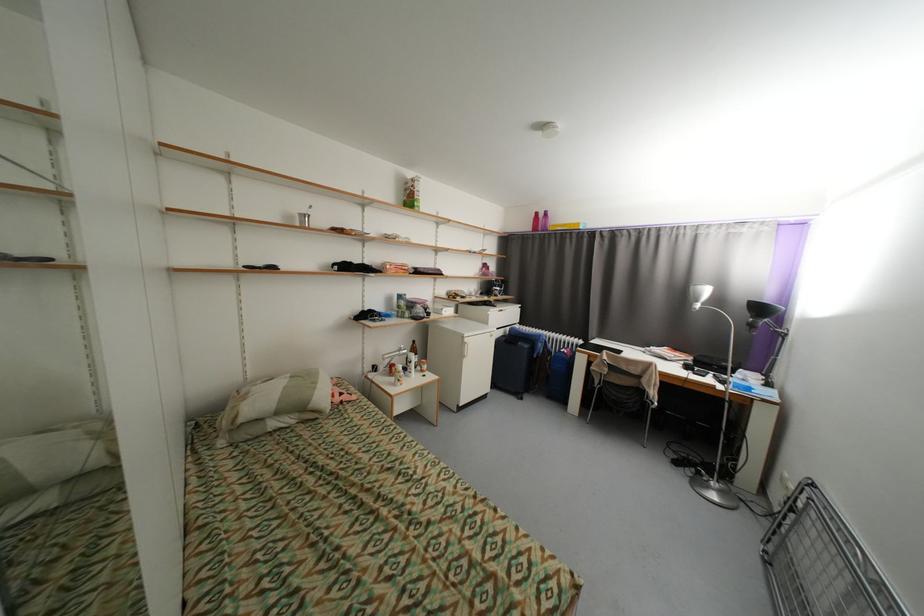
Where would you lift the folded drying rack? Please return your answer as a coordinate pair (x, y).

(821, 562)